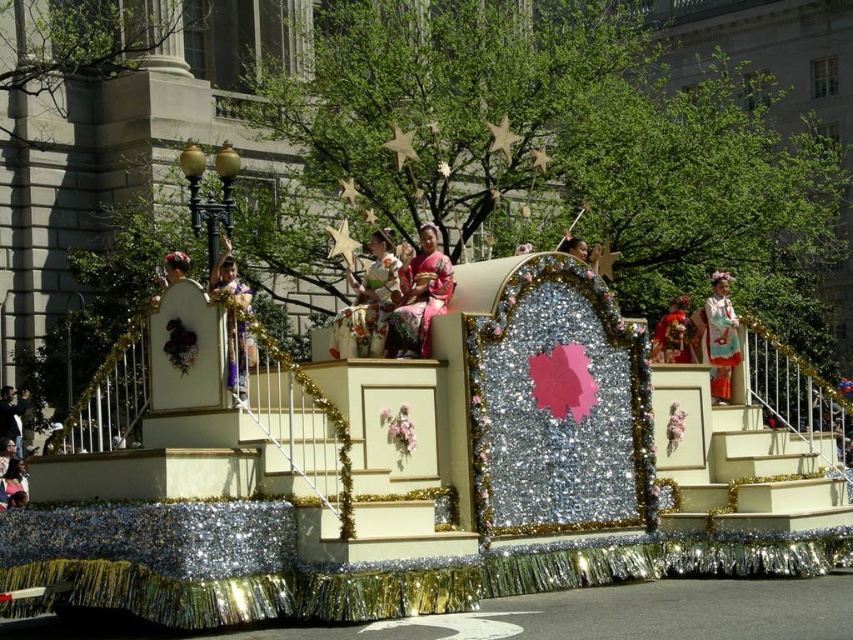
Who is higher up, silk kimono at left or silky pink kimono at center?

silk kimono at left is higher up.

Between silk kimono at left and silky pink kimono at center, which one has less height?

Standing shorter between the two is silky pink kimono at center.

Is point (228, 323) farther from camera compared to point (683, 296)?

That is False.

At what (x,y) coordinates should I click in order to perform the action: click on silk kimono at left. Please return your answer as a coordinate pair (x, y). Looking at the image, I should click on (233, 321).

Who is shorter, silky white kimono at center or dark blue fabric at lower left?

dark blue fabric at lower left

Consider the image. Does silky white kimono at center appear on the left side of dark blue fabric at lower left?

No, silky white kimono at center is not to the left of dark blue fabric at lower left.

Which is in front, point (372, 280) or point (18, 452)?

Point (372, 280) is more forward.

The image size is (853, 640). What are the coordinates of `silky white kimono at center` in the screenshot? It's located at (368, 304).

Which of these two, pink silk kimono at center or silky white kimono at center, stands shorter?

silky white kimono at center

Does pink silk kimono at center appear under silky white kimono at center?

Incorrect, pink silk kimono at center is not positioned below silky white kimono at center.

Is point (430, 276) positioned before point (352, 330)?

No, it is not.

You are a GUI agent. You are given a task and a screenshot of the screen. Output one action in this format:
    pyautogui.click(x=<x>, y=<y>)
    Task: Click on the pink silk kimono at center
    Image resolution: width=853 pixels, height=640 pixels.
    Given the screenshot: What is the action you would take?
    pyautogui.click(x=419, y=296)